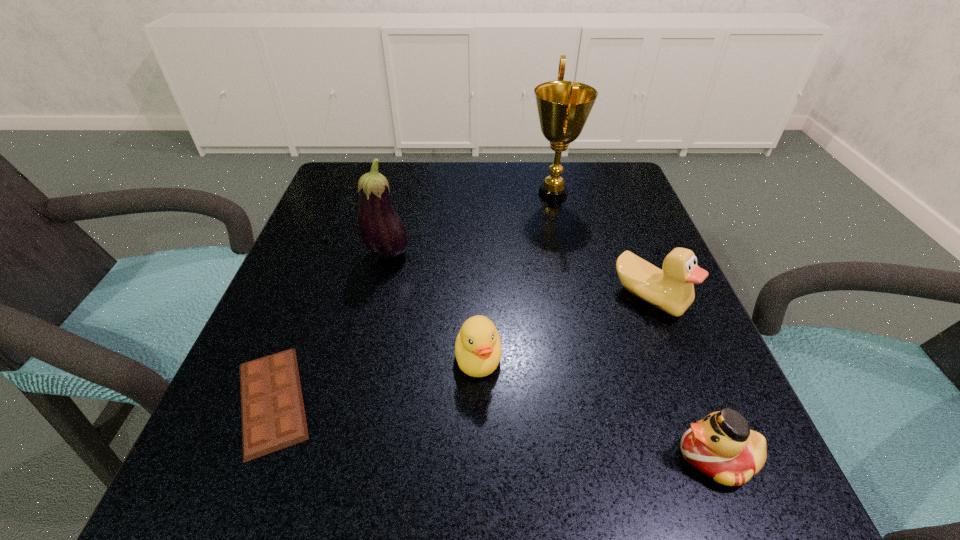
At what (x,y) coordinates should I click in order to perform the action: click on blank space at the far edge of the desktop. Please return your answer as a coordinate pair (x, y). This screenshot has height=540, width=960. Looking at the image, I should click on (420, 166).

I want to click on free region at the near edge of the desktop, so click(x=471, y=484).

This screenshot has height=540, width=960. Find the location of `vacant space at the left edge of the desktop`. vacant space at the left edge of the desktop is located at coordinates (347, 278).

This screenshot has height=540, width=960. Find the location of `free region at the far left corner of the desktop`. free region at the far left corner of the desktop is located at coordinates (344, 174).

Where is `vacant space at the near left corner of the desktop`? This screenshot has height=540, width=960. vacant space at the near left corner of the desktop is located at coordinates (248, 467).

The width and height of the screenshot is (960, 540). I want to click on vacant space at the far right corner, so click(x=590, y=178).

Identify the location of free location at the near right corner of the desktop. (656, 515).

Locate an element on the screen. This screenshot has width=960, height=540. free area in between the fourth object from right to left and the leftmost object is located at coordinates (375, 379).

This screenshot has width=960, height=540. I want to click on unoccupied area between the nearest duck and the tallest duck, so click(683, 377).

Locate an element on the screen. The height and width of the screenshot is (540, 960). vacant area that lies between the award and the leftmost duck is located at coordinates (516, 276).